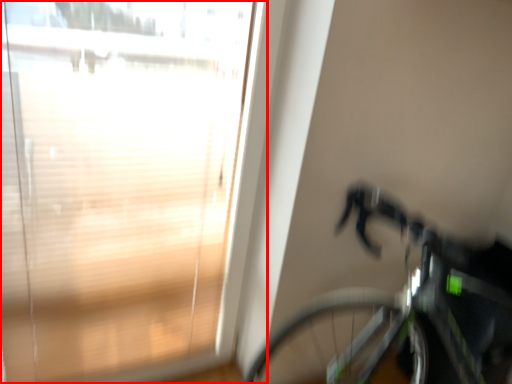
Question: From the image's perspective, what is the correct spatial positioning of window (annotated by the red box) in reference to bicycle?

Choices:
 (A) above
 (B) below

Answer: (A)